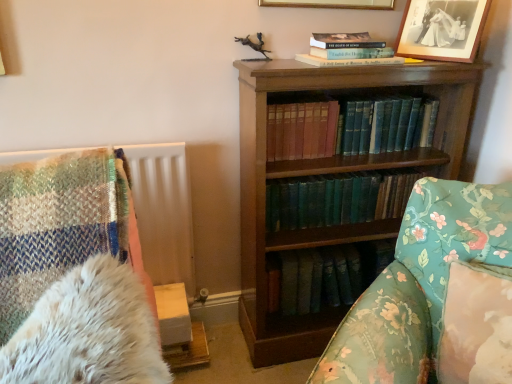
Question: Is black matte picture frame at upper right, the second picture frame positioned from the left, completely or partially outside of teal leather book at center, arranged as the second book when ordered from the bottom?

Choices:
 (A) yes
 (B) no

Answer: (A)

Question: Can you confirm if black matte picture frame at upper right, the second picture frame positioned from the left, is bigger than teal leather book at center, arranged as the second book when ordered from the bottom?

Choices:
 (A) no
 (B) yes

Answer: (A)

Question: Is black matte picture frame at upper right, the first picture frame viewed from the right, smaller than teal leather book at center, acting as the 1th book starting from the top?

Choices:
 (A) no
 (B) yes

Answer: (B)

Question: From a real-world perspective, is black matte picture frame at upper right, the first picture frame viewed from the right, on teal leather book at center, acting as the 1th book starting from the top?

Choices:
 (A) yes
 (B) no

Answer: (A)

Question: Considering the relative sizes of black matte picture frame at upper right, the second picture frame positioned from the left, and teal leather book at center, arranged as the second book when ordered from the bottom, in the image provided, is black matte picture frame at upper right, the second picture frame positioned from the left, shorter than teal leather book at center, arranged as the second book when ordered from the bottom,?

Choices:
 (A) yes
 (B) no

Answer: (B)

Question: Do you think black matte picture frame at upper right, the first picture frame viewed from the right, is within fluffy white pillow at lower right, or outside of it?

Choices:
 (A) outside
 (B) inside

Answer: (A)

Question: In the image, is black matte picture frame at upper right, the second picture frame positioned from the left, on the left side or the right side of fluffy white pillow at lower right?

Choices:
 (A) left
 (B) right

Answer: (B)

Question: Considering the positions of black matte picture frame at upper right, the first picture frame viewed from the right, and fluffy white pillow at lower right in the image, is black matte picture frame at upper right, the first picture frame viewed from the right, bigger or smaller than fluffy white pillow at lower right?

Choices:
 (A) big
 (B) small

Answer: (B)

Question: From their relative heights in the image, would you say black matte picture frame at upper right, the first picture frame viewed from the right, is taller or shorter than fluffy white pillow at lower right?

Choices:
 (A) tall
 (B) short

Answer: (B)

Question: Considering the positions of point (279, 3) and point (456, 340), is point (279, 3) closer or farther from the camera than point (456, 340)?

Choices:
 (A) closer
 (B) farther

Answer: (B)

Question: From their relative heights in the image, would you say gold-framed picture at upper center, which appears as the second picture frame when viewed from the right, is taller or shorter than fluffy white pillow at lower right?

Choices:
 (A) tall
 (B) short

Answer: (A)

Question: Is gold-framed picture at upper center, acting as the first picture frame starting from the left, situated inside fluffy white pillow at lower right or outside?

Choices:
 (A) outside
 (B) inside

Answer: (A)

Question: From a real-world perspective, relative to fluffy white pillow at lower right, is gold-framed picture at upper center, which appears as the second picture frame when viewed from the right, vertically above or below?

Choices:
 (A) below
 (B) above

Answer: (B)

Question: Looking at their shapes, would you say teal leather book at center, acting as the 1th book starting from the top, is wider or thinner than green leather book at center, placed as the second book when sorted from top to bottom?

Choices:
 (A) wide
 (B) thin

Answer: (B)

Question: Relative to green leather book at center, placed as the second book when sorted from top to bottom, is teal leather book at center, acting as the 1th book starting from the top, in front or behind?

Choices:
 (A) behind
 (B) front

Answer: (B)